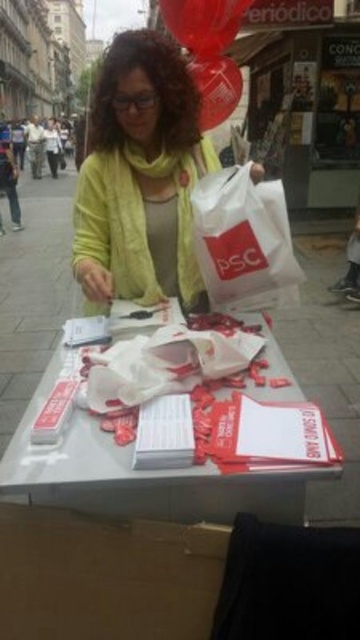
You are a photographer trying to capture both the brown cardboard box at lower left and the rubberized glossy balloon at upper center in the same frame. Which object should you focus on first to ensure both are in focus?

Answer: You should focus on the brown cardboard box at lower left first because it is closer to the viewer than the rubberized glossy balloon at upper center. By focusing on the closer object, the balloon will fall within the depth of field and remain sharp.

You are a volunteer at a political campaign event and need to place a new stack of leaflets. You see the brown cardboard box at lower left and the white paper at center. Which object is positioned to the right side?

The brown cardboard box at lower left is to the right of white paper at center, so the brown cardboard box at lower left is positioned to the right side.

You are a delivery person who needs to place a package between the white plastic bag at center and the rubberized glossy balloon at upper center. The package requires 5 feet of space. Can you fit it there?

The distance between the white plastic bag at center and the rubberized glossy balloon at upper center is 6.47 feet. Since the package needs 5 feet, it can fit as there is enough space.